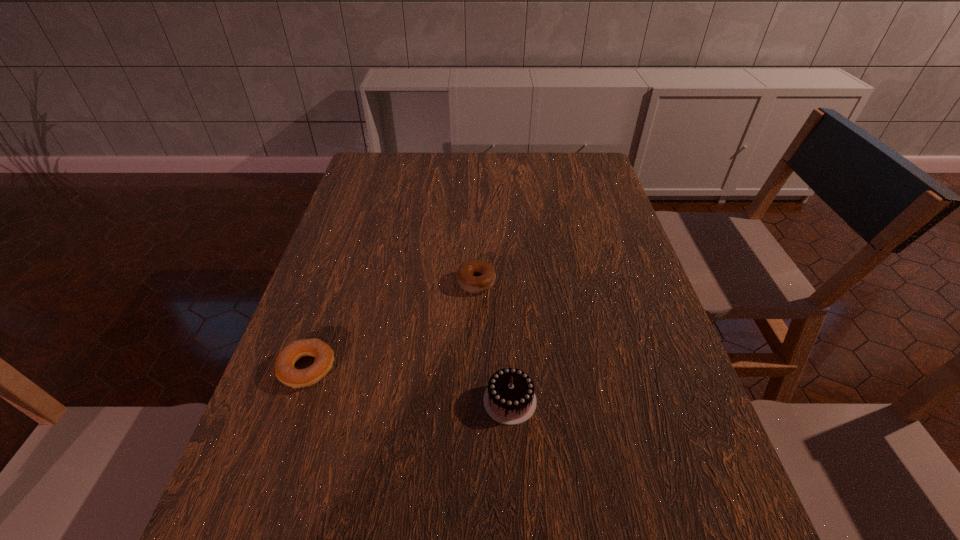
I want to click on vacant space at the left edge of the desktop, so click(x=345, y=278).

Identify the location of vacant space at the right edge of the desktop. This screenshot has height=540, width=960. (639, 275).

Locate an element on the screen. The image size is (960, 540). vacant area at the far right corner of the desktop is located at coordinates (580, 172).

You are a GUI agent. You are given a task and a screenshot of the screen. Output one action in this format:
    pyautogui.click(x=<x>, y=<y>)
    Task: Click on the free space between the leftmost object and the chocolate cake
    The width and height of the screenshot is (960, 540).
    Given the screenshot: What is the action you would take?
    pyautogui.click(x=408, y=384)

Find the location of a particular element. This screenshot has height=540, width=960. empty space that is in between the right bagel and the nearer bagel is located at coordinates (392, 325).

Find the location of a particular element. free spot between the nearer bagel and the right bagel is located at coordinates (392, 325).

At what (x,y) coordinates should I click in order to perform the action: click on vacant space that is in between the tallest object and the farther bagel. Please return your answer as a coordinate pair (x, y). This screenshot has height=540, width=960. Looking at the image, I should click on (493, 342).

You are a GUI agent. You are given a task and a screenshot of the screen. Output one action in this format:
    pyautogui.click(x=<x>, y=<y>)
    Task: Click on the empty space that is in between the leftmost object and the right bagel
    The width and height of the screenshot is (960, 540).
    Given the screenshot: What is the action you would take?
    pyautogui.click(x=392, y=325)

This screenshot has width=960, height=540. In order to click on free point between the tallest object and the farther bagel in this screenshot , I will do `click(493, 342)`.

At what (x,y) coordinates should I click in order to perform the action: click on free space between the farthest object and the tallest object. Please return your answer as a coordinate pair (x, y). This screenshot has height=540, width=960. Looking at the image, I should click on pyautogui.click(x=493, y=342).